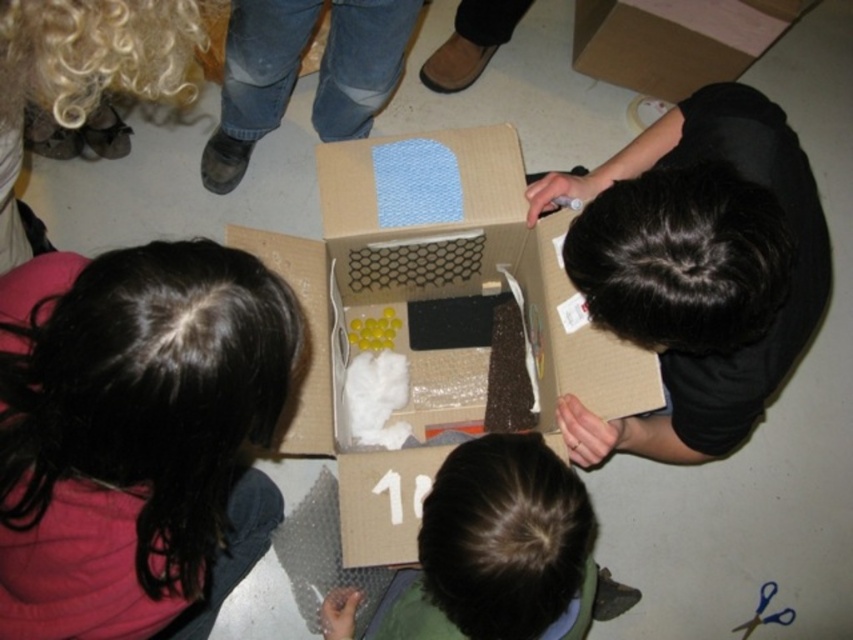
Question: Among these points, which one is farthest from the camera?

Choices:
 (A) (263, 45)
 (B) (506, 592)
 (C) (676, 234)

Answer: (A)

Question: Does brown fuzzy hair at lower center have a lesser width compared to jeans at center?

Choices:
 (A) yes
 (B) no

Answer: (A)

Question: Which point is farther to the camera?

Choices:
 (A) (663, 236)
 (B) (683, 3)
 (C) (457, 132)

Answer: (B)

Question: Which of the following is the farthest from the observer?

Choices:
 (A) (258, 444)
 (B) (512, 634)
 (C) (612, 4)

Answer: (C)

Question: Does cardboard box at center have a smaller size compared to brown fuzzy hair at lower center?

Choices:
 (A) yes
 (B) no

Answer: (B)

Question: Does dark brown hair at upper left lie in front of cardboard at upper center?

Choices:
 (A) no
 (B) yes

Answer: (B)